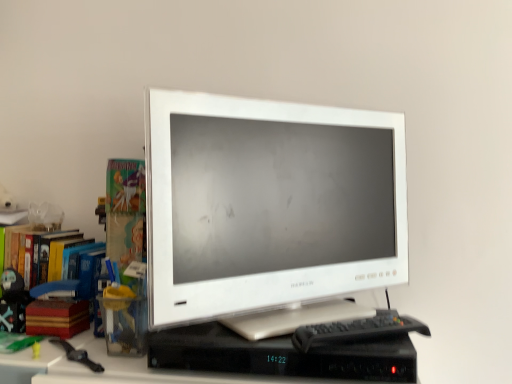
Question: Would you say wooden stack of books at left is a long distance from matte black figurine at left?

Choices:
 (A) yes
 (B) no

Answer: (B)

Question: Is wooden stack of books at left behind matte black figurine at left?

Choices:
 (A) yes
 (B) no

Answer: (B)

Question: Is wooden stack of books at left placed right next to matte black figurine at left?

Choices:
 (A) yes
 (B) no

Answer: (A)

Question: Is wooden stack of books at left turned away from matte black figurine at left?

Choices:
 (A) no
 (B) yes

Answer: (A)

Question: Does wooden stack of books at left appear on the left side of matte black figurine at left?

Choices:
 (A) yes
 (B) no

Answer: (B)

Question: Considering the relative sizes of wooden stack of books at left and matte black figurine at left in the image provided, is wooden stack of books at left shorter than matte black figurine at left?

Choices:
 (A) yes
 (B) no

Answer: (A)

Question: Is there a large distance between matte black figurine at left and multicolored cardboard books at left?

Choices:
 (A) yes
 (B) no

Answer: (B)

Question: Is matte black figurine at left located outside multicolored cardboard books at left?

Choices:
 (A) no
 (B) yes

Answer: (A)

Question: Can you confirm if matte black figurine at left is positioned to the left of multicolored cardboard books at left?

Choices:
 (A) no
 (B) yes

Answer: (A)

Question: Is matte black figurine at left positioned with its back to multicolored cardboard books at left?

Choices:
 (A) yes
 (B) no

Answer: (A)

Question: Does matte black figurine at left lie behind multicolored cardboard books at left?

Choices:
 (A) no
 (B) yes

Answer: (A)

Question: Considering the relative positions of matte black figurine at left and multicolored cardboard books at left in the image provided, is matte black figurine at left to the right of multicolored cardboard books at left from the viewer's perspective?

Choices:
 (A) yes
 (B) no

Answer: (A)

Question: From a real-world perspective, is matte black figurine at left on wooden stack of books at left?

Choices:
 (A) no
 (B) yes

Answer: (B)